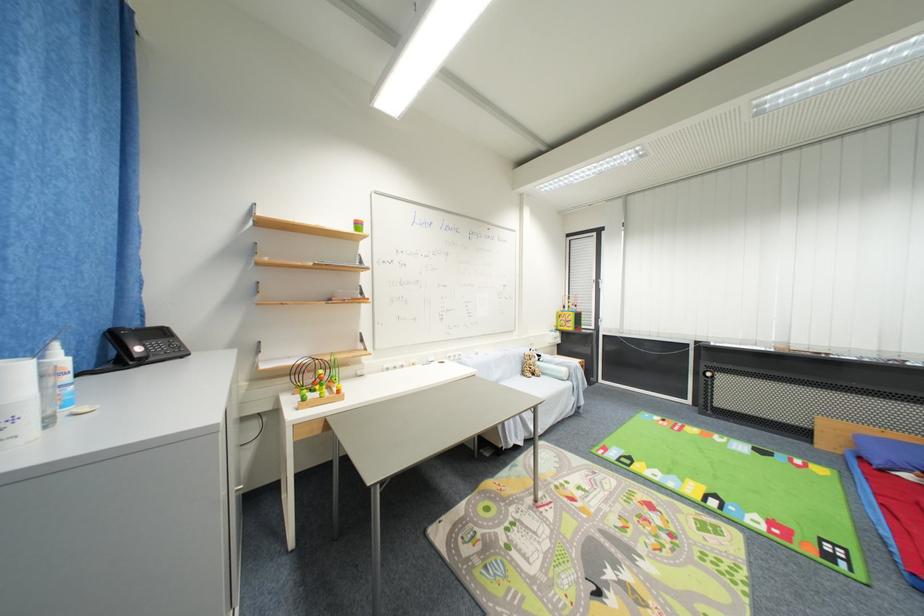
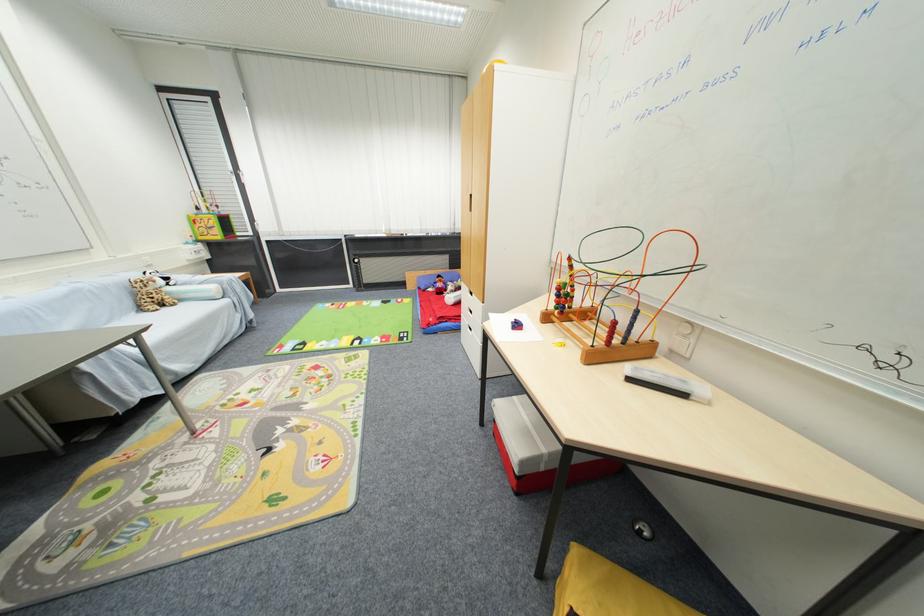
Find the pixel in the second image that matches (528,376) in the first image.

(146, 310)